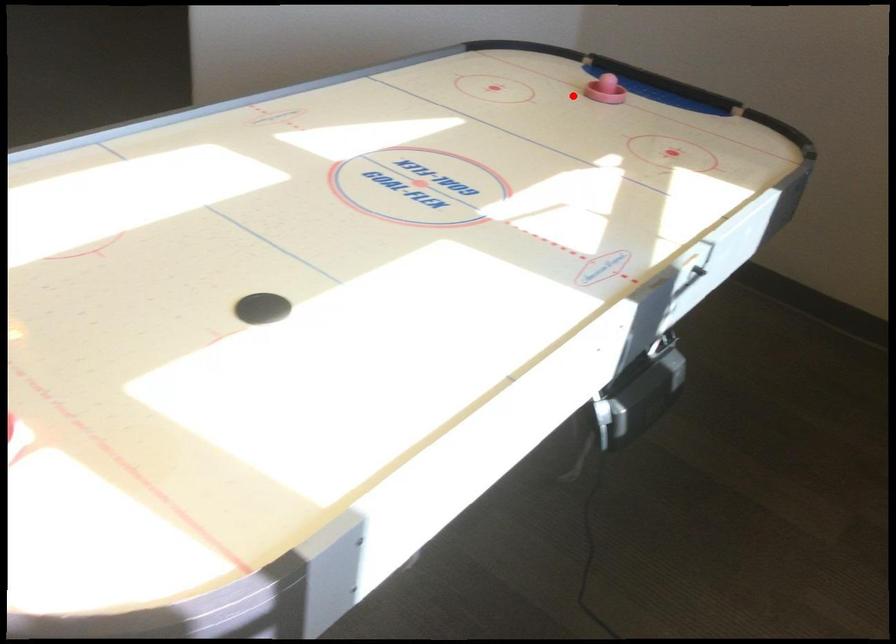
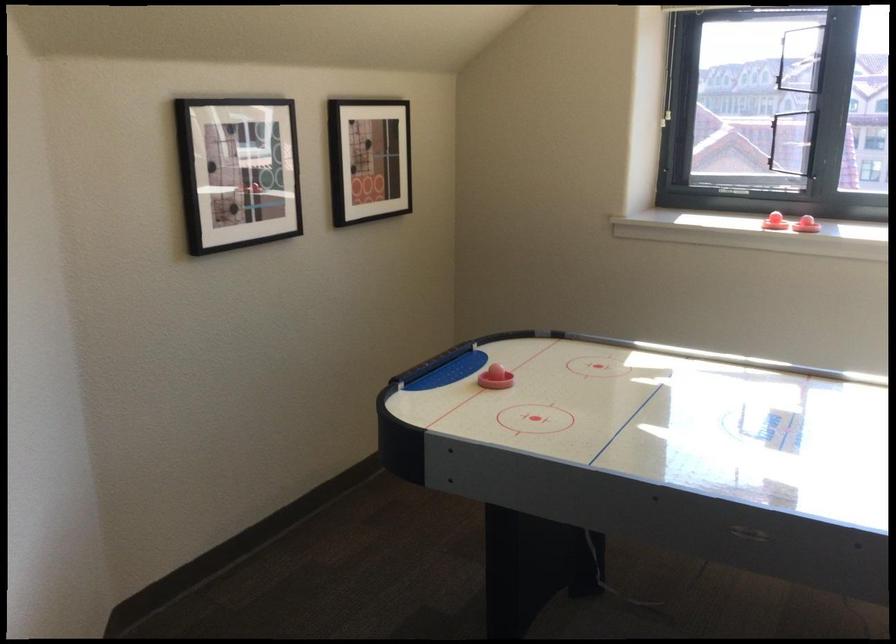
Question: I am providing you with two images of the same scene from different viewpoints. Given a red point in image1, look at the same physical point in image2. Is it:

Choices:
 (A) Closer to the viewpoint
 (B) Farther from the viewpoint

Answer: (B)